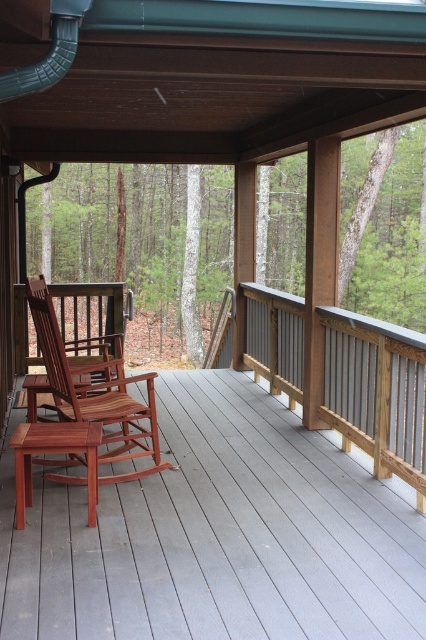
Question: Among these objects, which one is farthest from the camera?

Choices:
 (A) smooth gray wood deck at center
 (B) mahogany wood rocking chair at center
 (C) gray wood rail at right

Answer: (C)

Question: Can you confirm if smooth gray wood deck at center is thinner than mahogany wood rocking chair at center?

Choices:
 (A) no
 (B) yes

Answer: (A)

Question: Which object appears farthest from the camera in this image?

Choices:
 (A) smooth gray wood deck at center
 (B) gray wood rail at right

Answer: (B)

Question: Which of these objects is positioned farthest from the smooth gray wood deck at center?

Choices:
 (A) gray wood rail at right
 (B) mahogany wood rocking chair at center

Answer: (A)

Question: Does smooth gray wood deck at center appear on the left side of mahogany wood rocking chair at center?

Choices:
 (A) no
 (B) yes

Answer: (A)

Question: Is smooth gray wood deck at center below mahogany wood rocking chair at center?

Choices:
 (A) no
 (B) yes

Answer: (B)